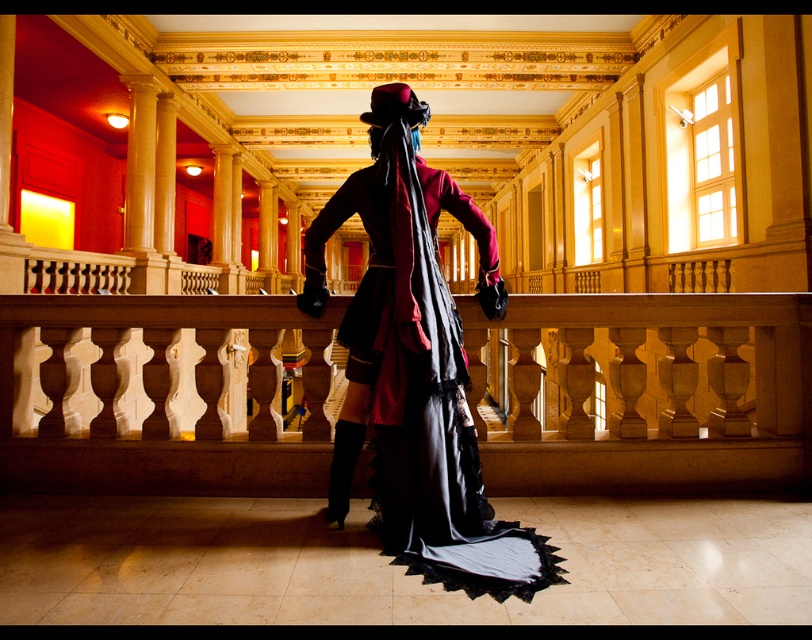
Can you confirm if wooden balustrade at center is positioned to the left of velvet maroon coat at center?

No, wooden balustrade at center is not to the left of velvet maroon coat at center.

Does wooden balustrade at center have a smaller size compared to velvet maroon coat at center?

Correct, wooden balustrade at center occupies less space than velvet maroon coat at center.

Locate an element on the screen. wooden balustrade at center is located at coordinates (648, 392).